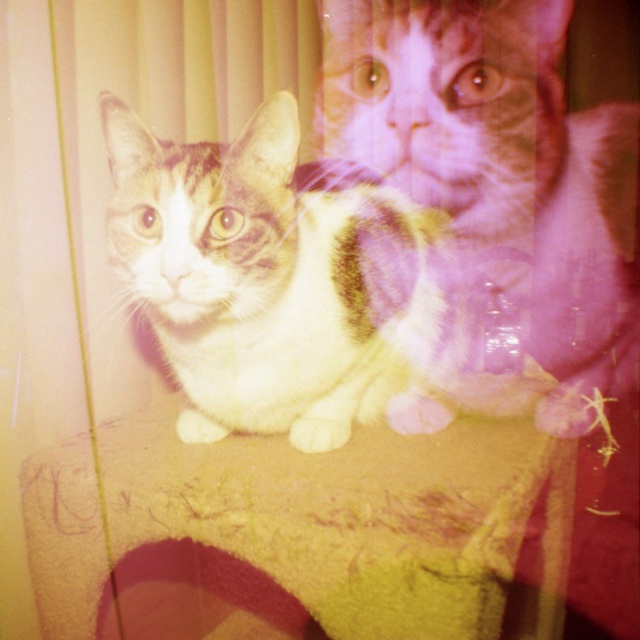
Can you confirm if white fur cat at center is bigger than calico fur cat at center?

No.

Based on the photo, who is positioned more to the right, white fur cat at center or calico fur cat at center?

From the viewer's perspective, calico fur cat at center appears more on the right side.

Between point (285, 173) and point (515, 252), which one is positioned in front?

Positioned in front is point (285, 173).

Locate an element on the screen. The height and width of the screenshot is (640, 640). white fur cat at center is located at coordinates (284, 291).